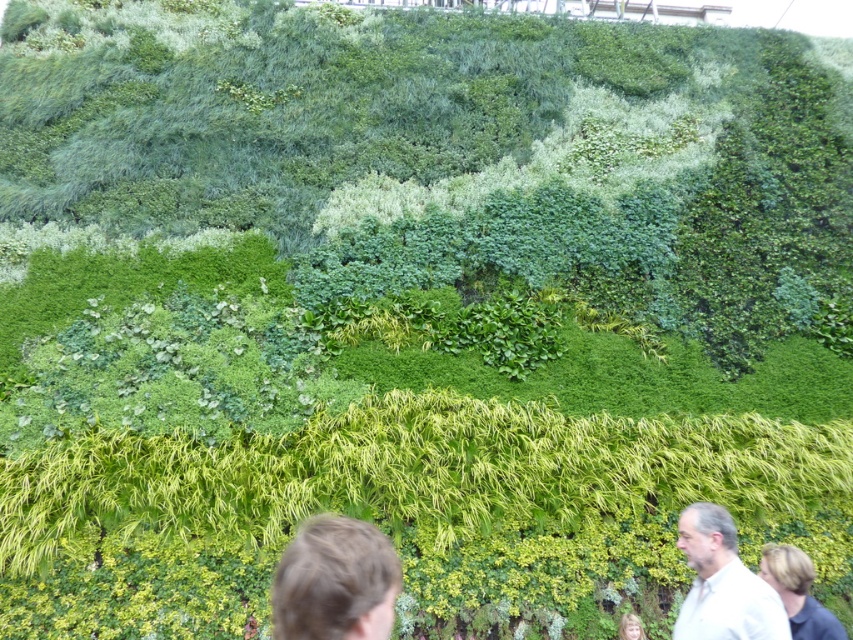
You are standing in front of a living wall and want to take a photo of both the brown hair at lower center and the white shirt at lower right. Based on the distance between them, can you fit both subjects into a standard smartphone camera frame that has a maximum width of 8 feet?

The distance between brown hair at lower center and white shirt at lower right is 9.58 feet, which exceeds the smartphone camera frame maximum width of 8 feet. Therefore, you cannot fit both subjects into the frame.

You are standing in front of the vibrant green living wall and notice two points marked on it. The first point is at coordinates point (299, 625) and the second point is at point (712, 579). Which of these two points is closer to you?

Point (299, 625) is closer to the viewer than point (712, 579).

You are standing in front of the living wall and notice a person with brown hair at lower center. Where exactly is the brown hair located in terms of coordinates?

The brown hair at lower center is located at coordinates point [335,580].